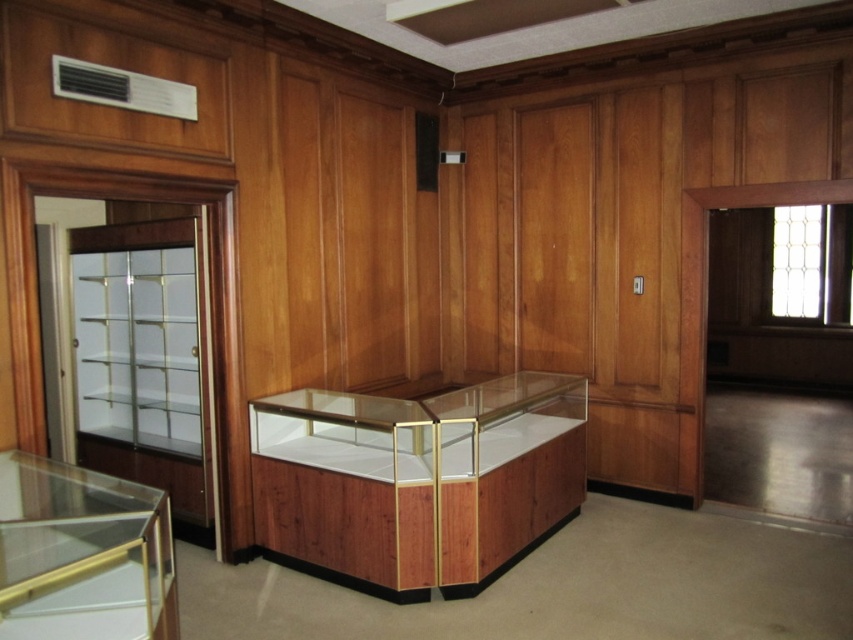
You are an interior designer planning to place a new decorative item in the room. You have a choice between placing it on the wooden display case at center or the transparent glass case at lower left. Which case is located above the other?

The transparent glass case at lower left is positioned above the wooden display case at center.